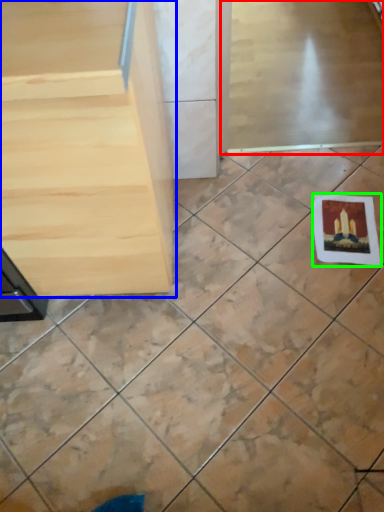
Question: Which object is positioned farthest from screen door (highlighted by a red box)? Select from furniture (highlighted by a blue box) and postcard (highlighted by a green box).

Choices:
 (A) furniture
 (B) postcard

Answer: (A)